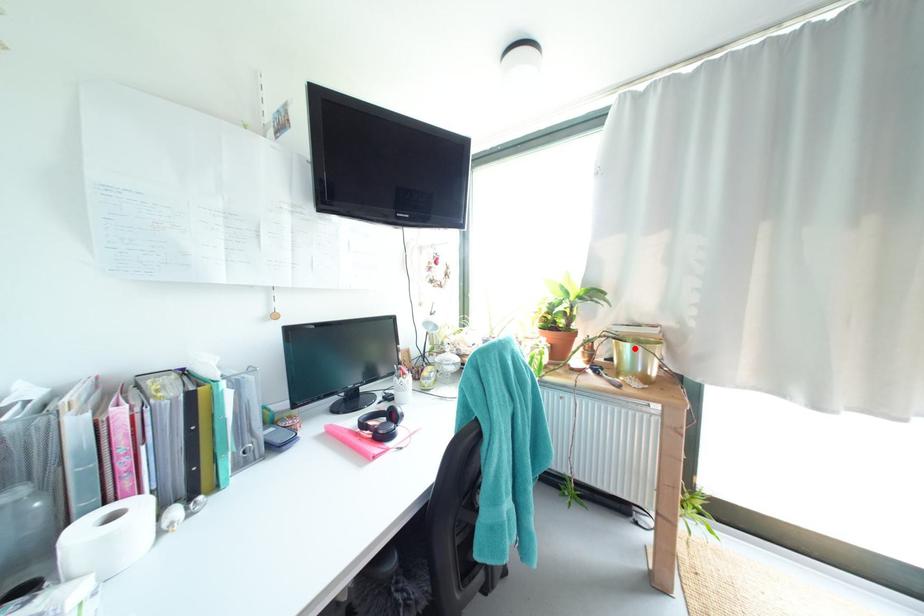
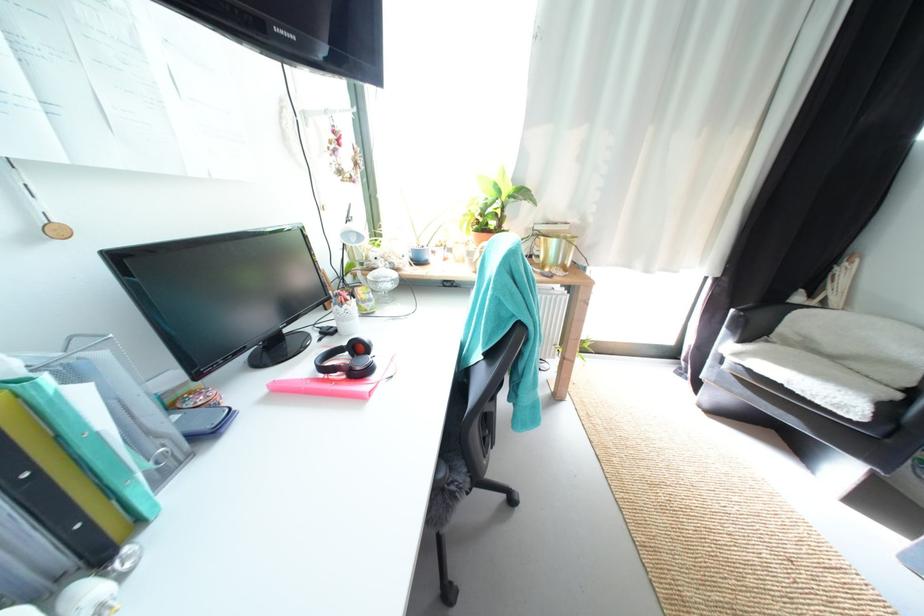
Locate, in the second image, the point that corresponds to the highlighted location in the first image.

(562, 244)